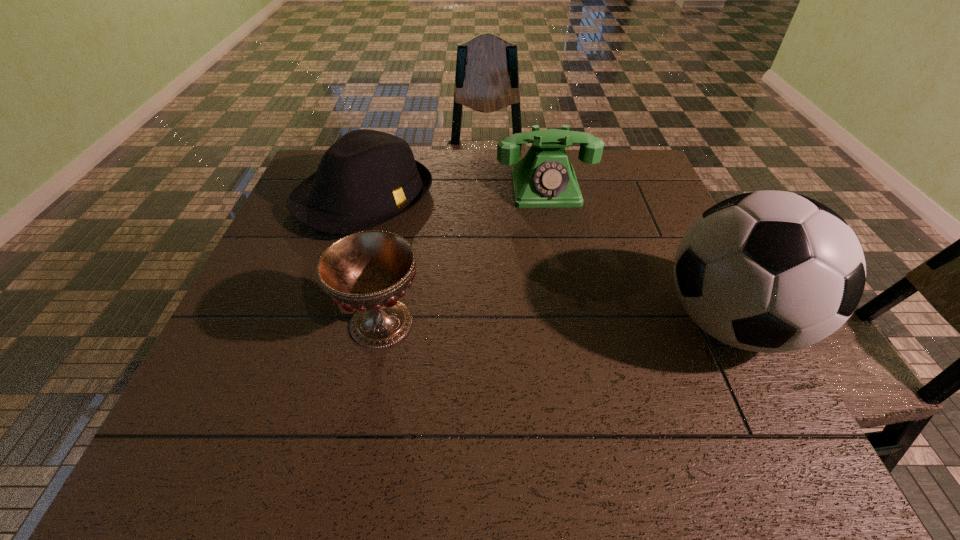
You are a GUI agent. You are given a task and a screenshot of the screen. Output one action in this format:
    pyautogui.click(x=<x>, y=<y>)
    Task: Click on the vacant point located between the telephone and the fedora
    This screenshot has width=960, height=540.
    Given the screenshot: What is the action you would take?
    pyautogui.click(x=455, y=194)

The image size is (960, 540). Identify the location of free spot between the rightmost object and the telephone. (637, 255).

The image size is (960, 540). In order to click on free space that is in between the tallest object and the chalice in this screenshot , I will do `click(556, 323)`.

The width and height of the screenshot is (960, 540). Find the location of `vacant space in between the fedora and the tallest object`. vacant space in between the fedora and the tallest object is located at coordinates (547, 261).

Locate an element on the screen. free spot between the tallest object and the fedora is located at coordinates (547, 261).

Select which object appears as the closest to the chalice. Please provide its 2D coordinates. Your answer should be formatted as a tuple, i.e. [(x, y)], where the tuple contains the x and y coordinates of a point satisfying the conditions above.

[(366, 178)]

Select which object is the closest to the third object from left to right. Please provide its 2D coordinates. Your answer should be formatted as a tuple, i.e. [(x, y)], where the tuple contains the x and y coordinates of a point satisfying the conditions above.

[(366, 178)]

The width and height of the screenshot is (960, 540). Identify the location of vacant area in the image that satisfies the following two spatial constraints: 1. on the back side of the fedora; 2. on the left side of the third object from left to right. (368, 188).

This screenshot has width=960, height=540. Identify the location of vacant space that satisfies the following two spatial constraints: 1. on the front side of the chalice; 2. on the right side of the fedora. (324, 323).

You are a GUI agent. You are given a task and a screenshot of the screen. Output one action in this format:
    pyautogui.click(x=<x>, y=<y>)
    Task: Click on the vacant space that satisfies the following two spatial constraints: 1. on the back side of the fedora; 2. on the right side of the second object from right to left
    
    Given the screenshot: What is the action you would take?
    pyautogui.click(x=368, y=188)